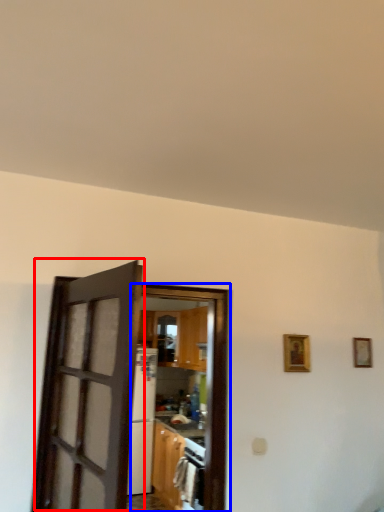
Question: Among these objects, which one is nearest to the camera, door (highlighted by a red box) or door (highlighted by a blue box)?

Choices:
 (A) door
 (B) door

Answer: (A)